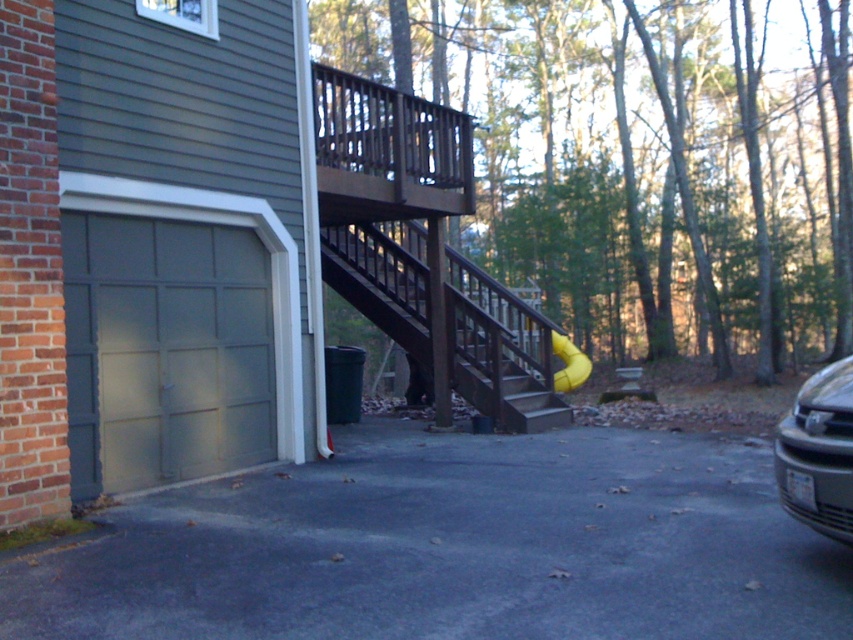
Question: Is silver metallic car at right bigger than yellow rubber slide at center?

Choices:
 (A) yes
 (B) no

Answer: (A)

Question: Which point is farther to the camera?

Choices:
 (A) gray asphalt driveway at lower center
 (B) yellow rubber slide at center
 (C) brown wooden stairs at center
 (D) silver metallic car at right

Answer: (B)

Question: Does matte gray garage door at lower left have a lesser width compared to brown wooden stairs at center?

Choices:
 (A) no
 (B) yes

Answer: (B)

Question: Which object appears farthest from the camera in this image?

Choices:
 (A) brown wooden stairs at center
 (B) silver metallic car at right

Answer: (A)

Question: Based on their relative distances, which object is farther from the gray asphalt driveway at lower center?

Choices:
 (A) yellow rubber slide at center
 (B) brown wooden stairs at center
 (C) matte gray garage door at lower left
 (D) silver metallic car at right

Answer: (A)

Question: In this image, where is brown wooden stairs at center located relative to yellow rubber slide at center?

Choices:
 (A) above
 (B) below

Answer: (A)